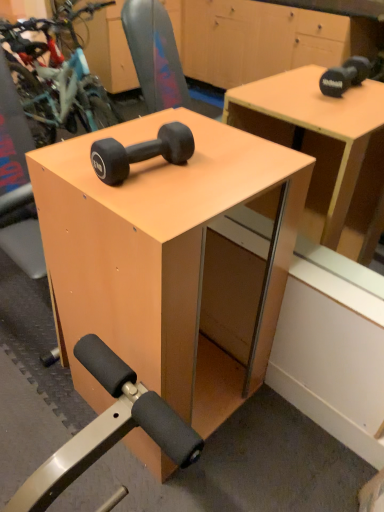
Question: Looking at the image, does matte wood dumbbell at center seem bigger or smaller compared to matte black dumbbell at center?

Choices:
 (A) big
 (B) small

Answer: (A)

Question: Is matte wood dumbbell at center in front of or behind matte black dumbbell at center in the image?

Choices:
 (A) front
 (B) behind

Answer: (A)

Question: Does point (274, 270) appear closer or farther from the camera than point (180, 161)?

Choices:
 (A) farther
 (B) closer

Answer: (A)

Question: From a real-world perspective, is matte black dumbbell at center positioned above or below matte wood dumbbell at center?

Choices:
 (A) above
 (B) below

Answer: (A)

Question: From the image's perspective, is matte black dumbbell at center positioned above or below matte wood dumbbell at center?

Choices:
 (A) below
 (B) above

Answer: (B)

Question: Based on their positions, is matte black dumbbell at center located to the left or right of matte wood dumbbell at center?

Choices:
 (A) left
 (B) right

Answer: (A)

Question: Does point (104, 155) appear closer or farther from the camera than point (289, 181)?

Choices:
 (A) farther
 (B) closer

Answer: (B)